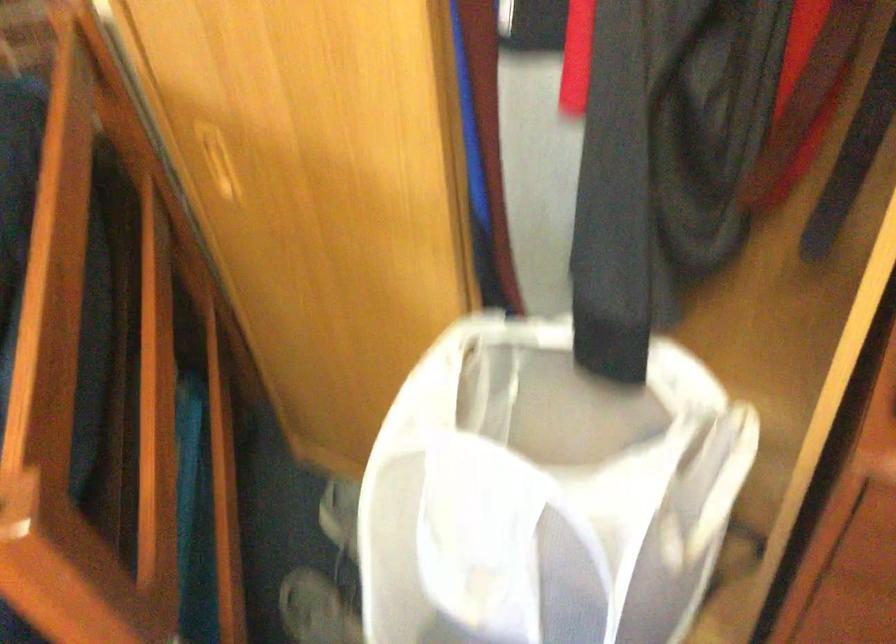
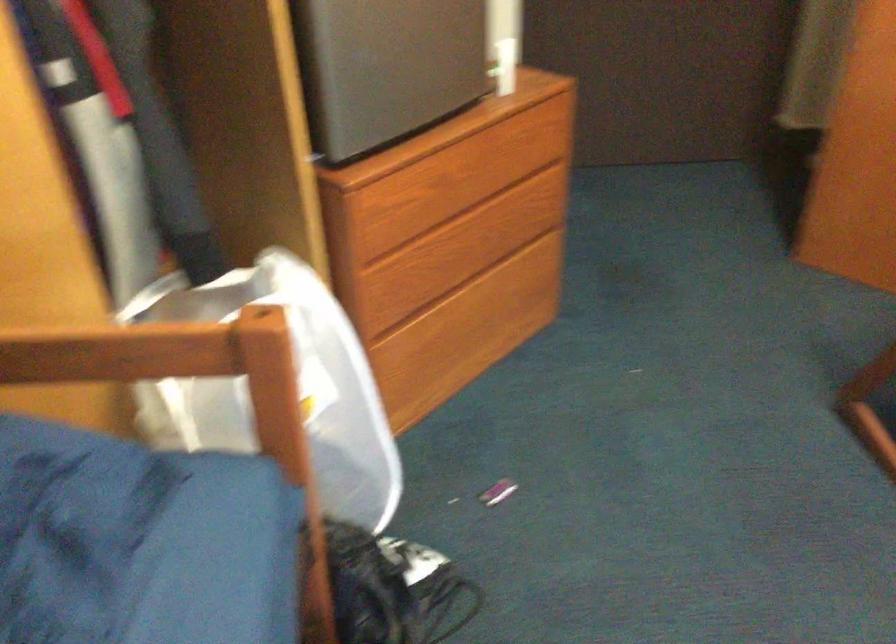
Question: The camera is either moving clockwise (left) or counter-clockwise (right) around the object. The first image is from the beginning of the video and the second image is from the end. Is the camera moving left or right when shooting the video?

Choices:
 (A) Left
 (B) Right

Answer: (A)